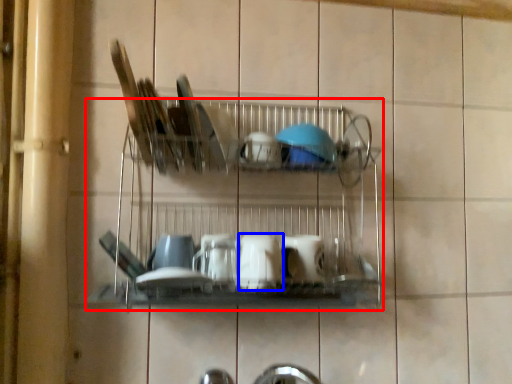
Question: Among these objects, which one is nearest to the camera, shelf (highlighted by a red box) or tableware (highlighted by a blue box)?

Choices:
 (A) shelf
 (B) tableware

Answer: (A)